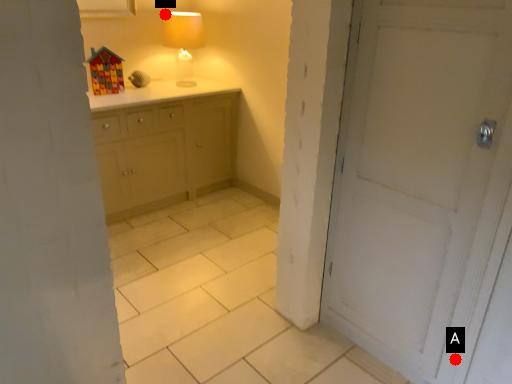
Question: Two points are circled on the image, labeled by A and B beside each circle. Which of the following is the closest to the observer?

Choices:
 (A) A is closer
 (B) B is closer

Answer: (A)